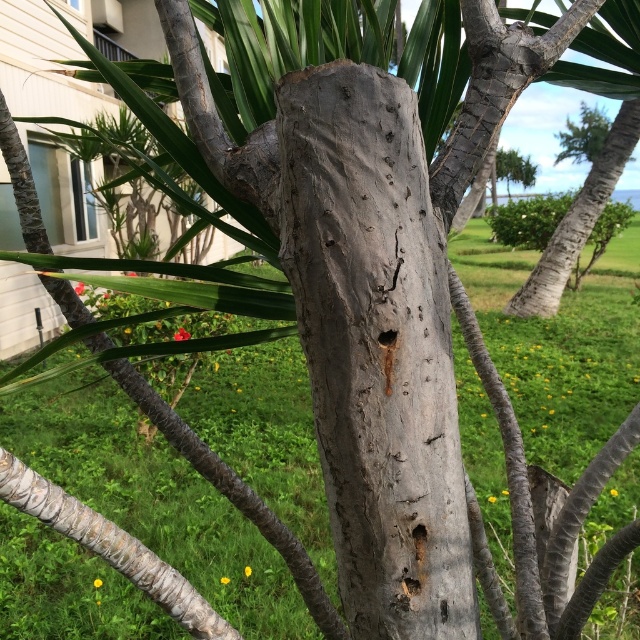
Can you confirm if gray rough bark tree trunk at center is thinner than gray textured trunk at center?

Indeed, gray rough bark tree trunk at center has a lesser width compared to gray textured trunk at center.

The width and height of the screenshot is (640, 640). In order to click on gray rough bark tree trunk at center in this screenshot , I will do `click(376, 348)`.